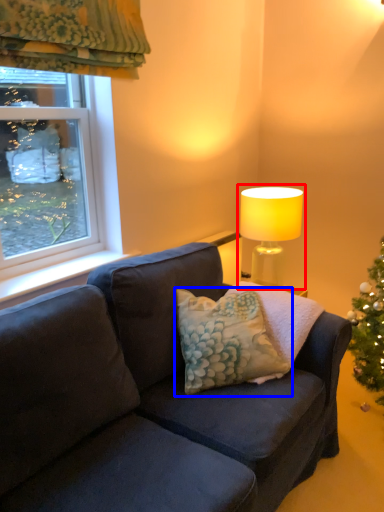
Question: Which object is closer to the camera taking this photo, lamp (highlighted by a red box) or pillow (highlighted by a blue box)?

Choices:
 (A) lamp
 (B) pillow

Answer: (B)